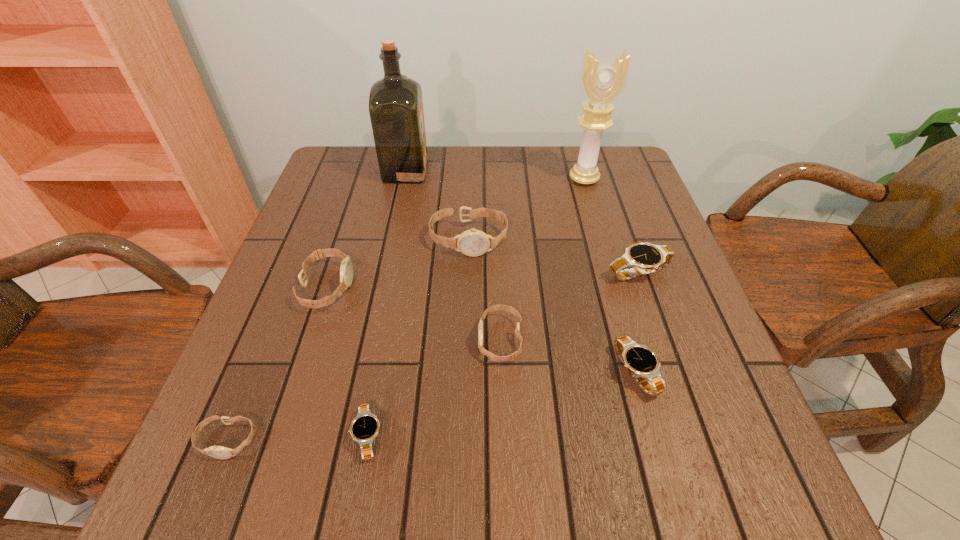
Image resolution: width=960 pixels, height=540 pixels. I want to click on free point at the far right corner, so click(x=628, y=151).

Find the location of a particular element. This screenshot has height=540, width=960. vacant area that lies between the nearest beige watch and the award is located at coordinates (406, 309).

Find the location of a particular element. This screenshot has height=540, width=960. vacant space in between the smallest beige watch and the biggest beige watch is located at coordinates (348, 340).

What are the coordinates of `empty space that is in between the farthest black watch and the sixth shortest watch` in the screenshot? It's located at (483, 280).

Find the location of a particular element. The height and width of the screenshot is (540, 960). vacant area that lies between the second nearest beige watch and the tallest watch is located at coordinates (485, 290).

Where is `free space between the award and the second farthest black watch`? This screenshot has height=540, width=960. free space between the award and the second farthest black watch is located at coordinates (610, 276).

This screenshot has width=960, height=540. I want to click on empty space between the second farthest black watch and the third farthest beige watch, so click(x=567, y=356).

The image size is (960, 540). Identify the location of free area in between the tallest watch and the sixth shortest watch. (397, 263).

This screenshot has width=960, height=540. In order to click on free space between the award and the second biggest black watch in this screenshot , I will do `click(610, 276)`.

Locate an element on the screen. The width and height of the screenshot is (960, 540). free point between the smallest black watch and the second nearest black watch is located at coordinates (501, 404).